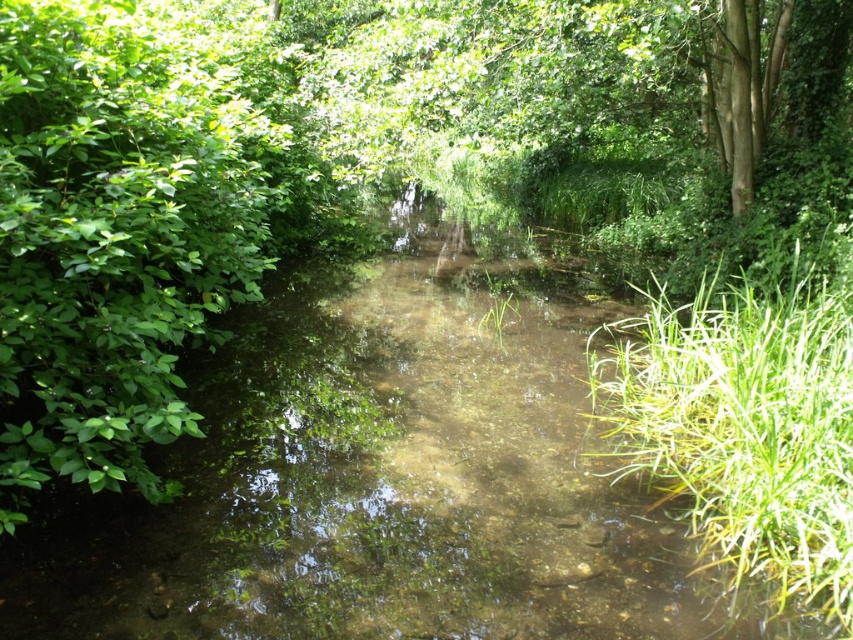
Question: Among these points, which one is farthest from the camera?

Choices:
 (A) (727, 481)
 (B) (424, 342)

Answer: (B)

Question: In this image, where is clear water stream at center located relative to green grassy at right?

Choices:
 (A) left
 (B) right

Answer: (A)

Question: Can you confirm if clear water stream at center is positioned above green grassy at right?

Choices:
 (A) yes
 (B) no

Answer: (B)

Question: Which of the following is the closest to the observer?

Choices:
 (A) (244, 372)
 (B) (677, 337)

Answer: (B)

Question: Considering the relative positions of clear water stream at center and green grassy at right in the image provided, where is clear water stream at center located with respect to green grassy at right?

Choices:
 (A) left
 (B) right

Answer: (A)